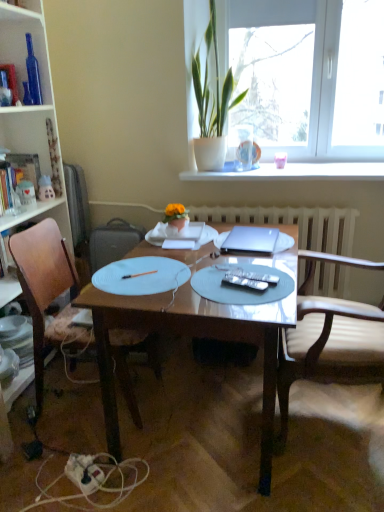
This screenshot has height=512, width=384. In order to click on vacant region to the right of green glossy plant at upper center in this screenshot , I will do `click(276, 169)`.